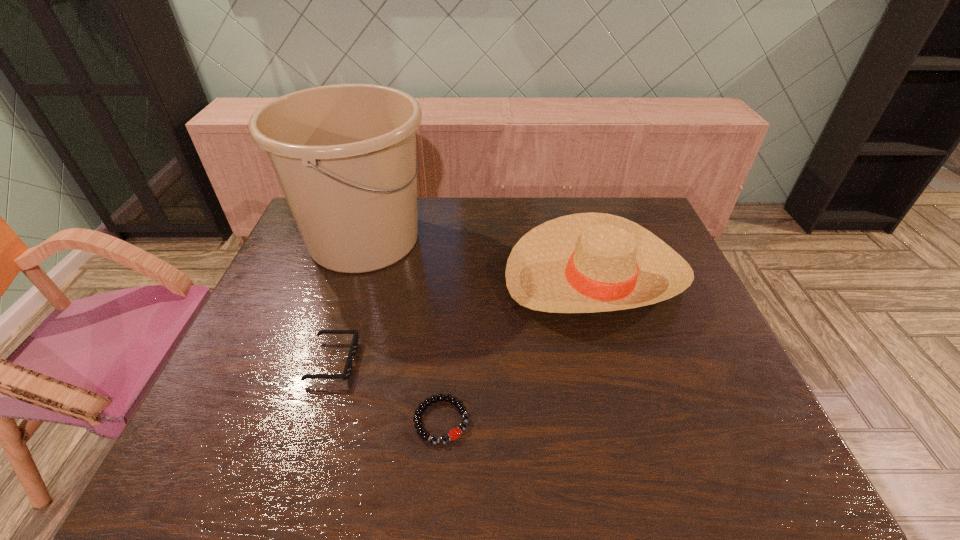
You are a GUI agent. You are given a task and a screenshot of the screen. Output one action in this format:
    pyautogui.click(x=<x>, y=<y>)
    Task: Click on the vacant area at the left edge of the desktop
    Image resolution: width=960 pixels, height=540 pixels.
    Given the screenshot: What is the action you would take?
    pyautogui.click(x=259, y=349)

In the image, there is a desktop. At what (x,y) coordinates should I click in order to perform the action: click on vacant space at the right edge. Please return your answer as a coordinate pair (x, y). The image size is (960, 540). Looking at the image, I should click on (x=703, y=379).

The height and width of the screenshot is (540, 960). What are the coordinates of `vacant space at the far right corner of the desktop` in the screenshot? It's located at (626, 214).

You are a GUI agent. You are given a task and a screenshot of the screen. Output one action in this format:
    pyautogui.click(x=<x>, y=<y>)
    Task: Click on the free space at the near right corner of the desktop
    The image size is (960, 540).
    Given the screenshot: What is the action you would take?
    pyautogui.click(x=749, y=458)

In order to click on free space that is in between the rightmost object and the second shortest object in this screenshot , I will do `click(464, 318)`.

You are a GUI agent. You are given a task and a screenshot of the screen. Output one action in this format:
    pyautogui.click(x=<x>, y=<y>)
    Task: Click on the empty location between the second object from right to left and the bucket
    Image resolution: width=960 pixels, height=540 pixels.
    Given the screenshot: What is the action you would take?
    pyautogui.click(x=403, y=330)

This screenshot has height=540, width=960. I want to click on vacant area that lies between the second tallest object and the second nearest object, so click(x=464, y=318).

What are the coordinates of `unoccupied position between the nearest object and the sunglasses` in the screenshot? It's located at (387, 391).

Where is `vacant space that's between the shortest object and the sunglasses`? The width and height of the screenshot is (960, 540). vacant space that's between the shortest object and the sunglasses is located at coordinates (387, 391).

The height and width of the screenshot is (540, 960). Find the location of `vacant point located between the bucket and the sunglasses`. vacant point located between the bucket and the sunglasses is located at coordinates (348, 300).